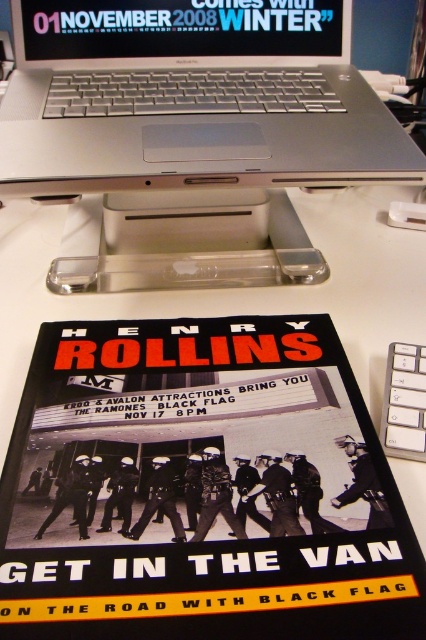
Which is behind, point (385, 531) or point (276, 109)?

Positioned behind is point (276, 109).

Where is `black paper poster at lower center`? black paper poster at lower center is located at coordinates (201, 488).

Locate an element on the screen. Image resolution: width=426 pixels, height=640 pixels. black paper poster at lower center is located at coordinates (201, 488).

Does point (80, 620) lie behind point (29, 49)?

No, it is not.

Which is above, black paper poster at lower center or matte plastic laptop at upper center?

Positioned higher is matte plastic laptop at upper center.

This screenshot has height=640, width=426. I want to click on black paper poster at lower center, so click(201, 488).

Is point (120, 6) in front of point (262, 13)?

Yes, point (120, 6) is in front of point (262, 13).

Consider the image. Which is more to the right, silver metallic laptop at upper center or matte plastic laptop at upper center?

silver metallic laptop at upper center

Is point (373, 92) closer to camera compared to point (140, 52)?

Yes, it is in front of point (140, 52).

I want to click on silver metallic laptop at upper center, so click(x=192, y=97).